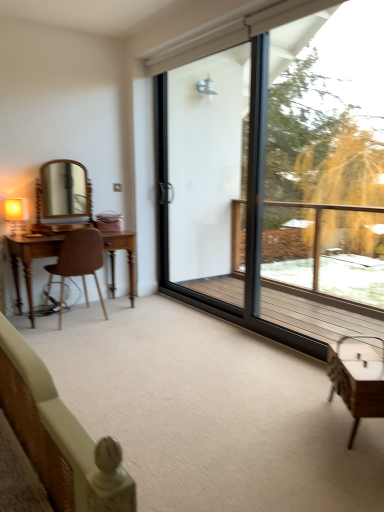
Describe the element at coordinates (279, 178) in the screenshot. Image resolution: width=384 pixels, height=512 pixels. I see `transparent glass window at center` at that location.

The image size is (384, 512). What do you see at coordinates (78, 262) in the screenshot? I see `brown leather chair at left` at bounding box center [78, 262].

What do you see at coordinates (357, 379) in the screenshot?
I see `white glossy table at lower right, which is the first table in front-to-back order` at bounding box center [357, 379].

At what (x,y) coordinates should I click in order to perform the action: click on transparent glass screen door at center. Please return your answer as a coordinate pair (x, y). Looking at the image, I should click on click(x=206, y=170).

Describe the element at coordinates (314, 158) in the screenshot. I see `green leafy tree at right` at that location.

The height and width of the screenshot is (512, 384). I want to click on transparent glass window at center, so click(279, 178).

Between white glossy table at lower right, which is the first table in front-to-back order, and transparent glass screen door at center, which one has less height?

With less height is white glossy table at lower right, which is the first table in front-to-back order.

Does point (348, 350) come farther from viewer compared to point (237, 247)?

That is False.

Is white glossy table at lower right, which is counted as the second table, starting from the back, turned away from transparent glass screen door at center?

No, white glossy table at lower right, which is counted as the second table, starting from the back, is not facing away from transparent glass screen door at center.

Would you say white glossy table at lower right, arranged as the second table when viewed from the left, is outside transparent glass screen door at center?

That's correct, white glossy table at lower right, arranged as the second table when viewed from the left, is outside of transparent glass screen door at center.

Which of these two, matte gold table lamp at left or wooden desk at left, acting as the 2th table starting from the right, is bigger?

wooden desk at left, acting as the 2th table starting from the right.

Could you measure the distance between matte gold table lamp at left and wooden desk at left, the first table in the back-to-front sequence?

The distance of matte gold table lamp at left from wooden desk at left, the first table in the back-to-front sequence, is 13.18 inches.

From a real-world perspective, is matte gold table lamp at left on wooden desk at left, the 2th table from the front?

Answer: Yes, from a real-world perspective, matte gold table lamp at left is above wooden desk at left, the 2th table from the front.

Choose the correct answer: Is matte gold table lamp at left inside wooden desk at left, acting as the 2th table starting from the right, or outside it?

matte gold table lamp at left is not enclosed by wooden desk at left, acting as the 2th table starting from the right.

From a real-world perspective, between wooden desk at left, the first table positioned from the left, and white glossy table at lower right, which is the 1th table from right to left, who is vertically higher?

From a 3D spatial view, wooden desk at left, the first table positioned from the left, is above.

Is wooden desk at left, the 2th table from the front, next to white glossy table at lower right, which is the first table in front-to-back order, and touching it?

No, wooden desk at left, the 2th table from the front, is not touching white glossy table at lower right, which is the first table in front-to-back order.

Looking at this image, between wooden desk at left, the first table in the back-to-front sequence, and white glossy table at lower right, which is the first table in front-to-back order, which one appears on the right side from the viewer's perspective?

white glossy table at lower right, which is the first table in front-to-back order.

Can you confirm if transparent glass screen door at center is taller than transparent glass window at center?

Yes.

From a real-world perspective, is transparent glass screen door at center physically located above or below transparent glass window at center?

From a real-world perspective, transparent glass screen door at center is physically above transparent glass window at center.

From the image's perspective, is transparent glass screen door at center on transparent glass window at center?

Yes.

Do you think transparent glass screen door at center is within transparent glass window at center, or outside of it?

transparent glass screen door at center can be found inside transparent glass window at center.

Is wooden desk at left, acting as the 2th table starting from the right, oriented away from brown leather chair at left?

Correct, wooden desk at left, acting as the 2th table starting from the right, is looking away from brown leather chair at left.

From a real-world perspective, is wooden desk at left, acting as the 2th table starting from the right, physically located above or below brown leather chair at left?

wooden desk at left, acting as the 2th table starting from the right, is below brown leather chair at left.

Looking at this image, is wooden desk at left, acting as the 2th table starting from the right, next to brown leather chair at left?

No, wooden desk at left, acting as the 2th table starting from the right, is not touching brown leather chair at left.

Is wooden desk at left, the first table positioned from the left, in front of or behind brown leather chair at left in the image?

wooden desk at left, the first table positioned from the left, is behind brown leather chair at left.

Is there a large distance between transparent glass screen door at center and matte gold table lamp at left?

transparent glass screen door at center is positioned a significant distance from matte gold table lamp at left.

Is transparent glass screen door at center facing away from matte gold table lamp at left?

transparent glass screen door at center does not have its back to matte gold table lamp at left.

At what (x,y) coordinates should I click in order to perform the action: click on table lamp below the transparent glass screen door at center (from the image's perspective). Please return your answer as a coordinate pair (x, y). This screenshot has height=512, width=384. Looking at the image, I should click on (16, 215).

Is green leafy tree at right wider or thinner than transparent glass screen door at center?

In the image, green leafy tree at right appears to be wider than transparent glass screen door at center.

Is green leafy tree at right facing towards transparent glass screen door at center?

No, green leafy tree at right is not aimed at transparent glass screen door at center.

From a real-world perspective, is green leafy tree at right physically located above or below transparent glass screen door at center?

Clearly, from a real-world perspective, green leafy tree at right is above transparent glass screen door at center.

Which is correct: green leafy tree at right is inside transparent glass screen door at center, or outside of it?

green leafy tree at right exists outside the volume of transparent glass screen door at center.

Identify the location of table lying in front of the transparent glass screen door at center. point(357,379).

I want to click on table lamp that appears behind the wooden desk at left, acting as the 2th table starting from the right, so click(16, 215).

From the image, which object appears to be farther from white glossy table at lower right, which is counted as the second table, starting from the back, wooden desk at left, the first table positioned from the left, or transparent glass window at center?

transparent glass window at center is further to white glossy table at lower right, which is counted as the second table, starting from the back.

When comparing their distances from transparent glass window at center, does green leafy tree at right or white glossy table at lower right, arranged as the second table when viewed from the left, seem closer?

green leafy tree at right.

Considering their positions, is matte gold table lamp at left positioned closer to white glossy table at lower right, which is the first table in front-to-back order, than transparent glass screen door at center?

matte gold table lamp at left.

Considering their positions, is transparent glass screen door at center positioned closer to transparent glass window at center than brown leather chair at left?

Based on the image, transparent glass screen door at center appears to be nearer to transparent glass window at center.

Looking at the image, which one is located further to transparent glass screen door at center, white glossy table at lower right, which is counted as the second table, starting from the back, or brown leather chair at left?

white glossy table at lower right, which is counted as the second table, starting from the back, lies further to transparent glass screen door at center than the other object.

Considering their positions, is green leafy tree at right positioned further to wooden desk at left, the 2th table from the front, than brown leather chair at left?

green leafy tree at right lies further to wooden desk at left, the 2th table from the front, than the other object.

Estimate the real-world distances between objects in this image. Which object is closer to matte gold table lamp at left, wooden desk at left, the first table positioned from the left, or green leafy tree at right?

Based on the image, wooden desk at left, the first table positioned from the left, appears to be nearer to matte gold table lamp at left.

Considering their positions, is green leafy tree at right positioned further to transparent glass window at center than matte gold table lamp at left?

matte gold table lamp at left.

The image size is (384, 512). I want to click on table located between matte gold table lamp at left and white glossy table at lower right, which is the 1th table from right to left, in the left-right direction, so click(31, 261).

Locate an element on the screen. table situated between matte gold table lamp at left and green leafy tree at right from left to right is located at coordinates (31, 261).

Identify the location of screen door located between matte gold table lamp at left and white glossy table at lower right, arranged as the second table when viewed from the left, in the left-right direction. The image size is (384, 512). coord(206,170).

Image resolution: width=384 pixels, height=512 pixels. What are the coordinates of `window that lies between green leafy tree at right and white glossy table at lower right, which is counted as the second table, starting from the back, from top to bottom` in the screenshot? It's located at 279,178.